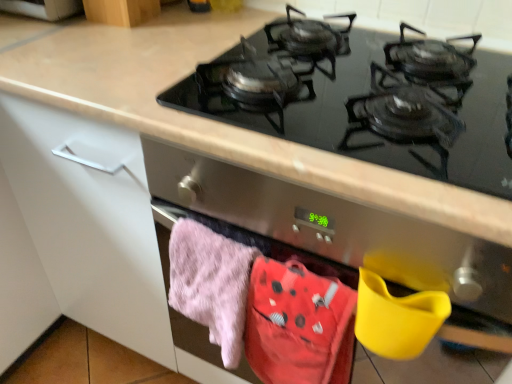
Question: Is fluffy pink towel at lower left located within black glass gas stove at upper center?

Choices:
 (A) yes
 (B) no

Answer: (B)

Question: Is black glass gas stove at upper center not near fluffy pink towel at lower left?

Choices:
 (A) no
 (B) yes

Answer: (A)

Question: Does black glass gas stove at upper center appear on the right side of fluffy pink towel at lower left?

Choices:
 (A) no
 (B) yes

Answer: (B)

Question: Does black glass gas stove at upper center have a smaller size compared to fluffy pink towel at lower left?

Choices:
 (A) no
 (B) yes

Answer: (A)

Question: Is black glass gas stove at upper center oriented towards fluffy pink towel at lower left?

Choices:
 (A) yes
 (B) no

Answer: (B)

Question: Is point (128, 9) positioned closer to the camera than point (182, 102)?

Choices:
 (A) closer
 (B) farther

Answer: (B)

Question: Considering their positions, is wooden cabinet at upper left located in front of or behind black glass gas stove at upper center?

Choices:
 (A) front
 (B) behind

Answer: (B)

Question: In terms of width, does wooden cabinet at upper left look wider or thinner when compared to black glass gas stove at upper center?

Choices:
 (A) thin
 (B) wide

Answer: (A)

Question: Based on their sizes in the image, would you say wooden cabinet at upper left is bigger or smaller than black glass gas stove at upper center?

Choices:
 (A) small
 (B) big

Answer: (A)

Question: Is wooden cabinet at upper left inside the boundaries of fluffy pink towel at lower left, or outside?

Choices:
 (A) outside
 (B) inside

Answer: (A)

Question: Considering the positions of wooden cabinet at upper left and fluffy pink towel at lower left in the image, is wooden cabinet at upper left taller or shorter than fluffy pink towel at lower left?

Choices:
 (A) short
 (B) tall

Answer: (A)

Question: Relative to fluffy pink towel at lower left, is wooden cabinet at upper left in front or behind?

Choices:
 (A) front
 (B) behind

Answer: (B)

Question: Is point coord(122,13) closer or farther from the camera than point coord(216,238)?

Choices:
 (A) farther
 (B) closer

Answer: (A)

Question: Looking at their shapes, would you say fluffy pink towel at lower left is wider or thinner than black glass gas stove at upper center?

Choices:
 (A) wide
 (B) thin

Answer: (B)

Question: From a real-world perspective, is fluffy pink towel at lower left physically located above or below black glass gas stove at upper center?

Choices:
 (A) above
 (B) below

Answer: (B)